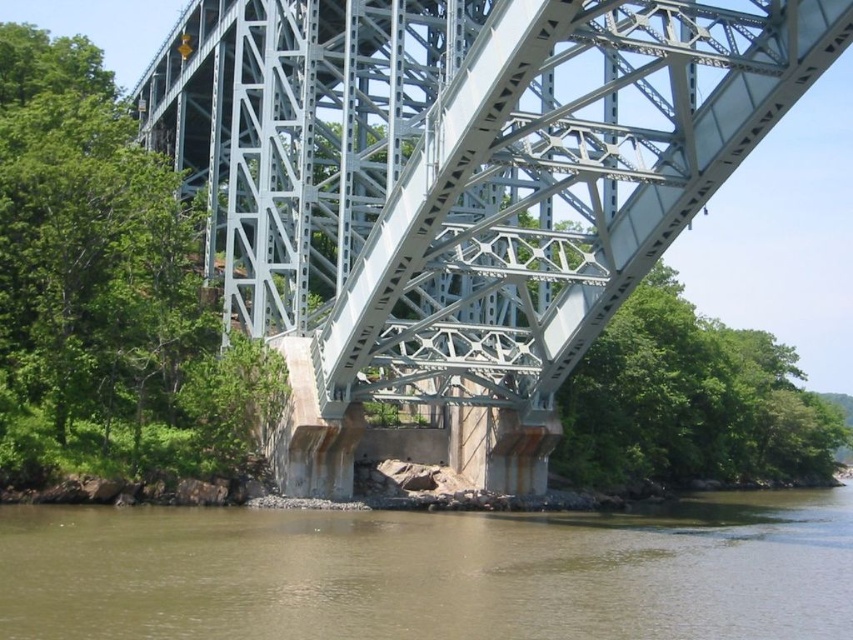
Measure the distance between point (370, 138) and camera.

339.60 feet

Which of these two, metallic steel arch bridge at center or brown sedimentary rock at lower center, stands shorter?

brown sedimentary rock at lower center is shorter.

Between point (437, 193) and point (502, 561), which one is positioned behind?

Positioned behind is point (437, 193).

What are the coordinates of `metallic steel arch bridge at center` in the screenshot? It's located at (462, 172).